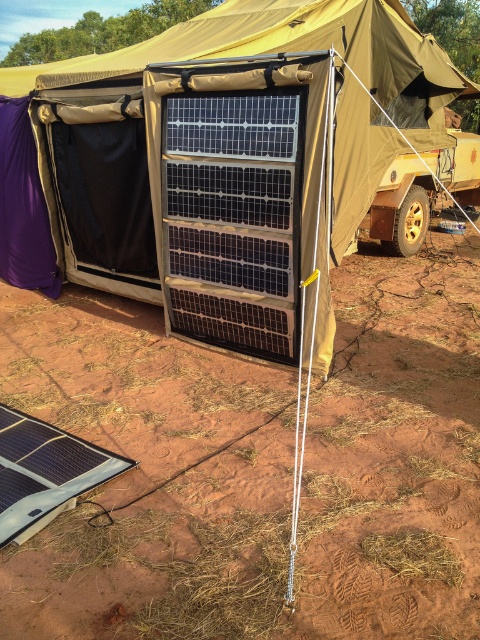
Question: Does black textured solar panel at center appear under black flexible solar panel at lower left?

Choices:
 (A) yes
 (B) no

Answer: (B)

Question: Which object appears farthest from the camera in this image?

Choices:
 (A) dirt at lower left
 (B) black textured solar panel at center
 (C) black solar panel at center
 (D) black flexible solar panel at lower left

Answer: (C)

Question: Which object is closer to the camera taking this photo?

Choices:
 (A) black solar panel at center
 (B) black textured solar panel at center

Answer: (B)

Question: Which object is positioned closest to the black textured solar panel at center?

Choices:
 (A) black solar panel at center
 (B) dirt at lower left

Answer: (A)

Question: In this image, where is black solar panel at center located relative to black flexible solar panel at lower left?

Choices:
 (A) below
 (B) above

Answer: (B)

Question: Does dirt at lower left have a greater width compared to black flexible solar panel at lower left?

Choices:
 (A) no
 (B) yes

Answer: (B)